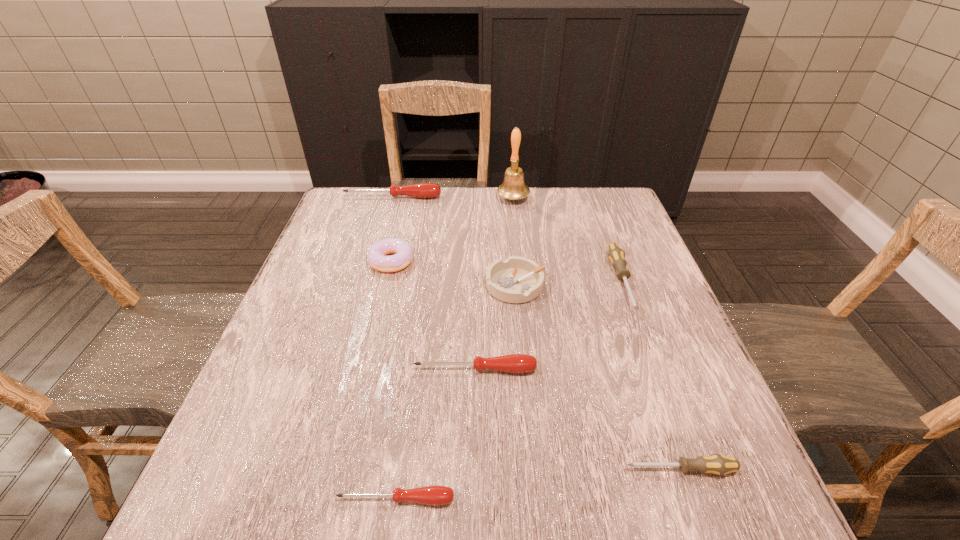
This screenshot has height=540, width=960. Identify the location of bell. (513, 187).

This screenshot has height=540, width=960. I want to click on the farthest screwdriver, so click(x=422, y=190).

The height and width of the screenshot is (540, 960). What are the coordinates of `the farthest red screwdriver` in the screenshot? It's located at (422, 190).

I want to click on doughnut, so click(x=403, y=254).

At what (x,y) coordinates should I click in order to perform the action: click on the bigger gray screwdriver. Please return your answer as a coordinate pair (x, y). Image resolution: width=960 pixels, height=540 pixels. Looking at the image, I should click on click(x=616, y=255).

This screenshot has height=540, width=960. In order to click on the farther gray screwdriver in this screenshot , I will do `click(616, 255)`.

Identify the location of ashtray. Image resolution: width=960 pixels, height=540 pixels. (517, 279).

This screenshot has width=960, height=540. Find the location of `the third nearest object`. the third nearest object is located at coordinates (514, 363).

The width and height of the screenshot is (960, 540). I want to click on the second nearest red screwdriver, so click(514, 363).

Locate an element on the screen. The width and height of the screenshot is (960, 540). the smaller gray screwdriver is located at coordinates (717, 464).